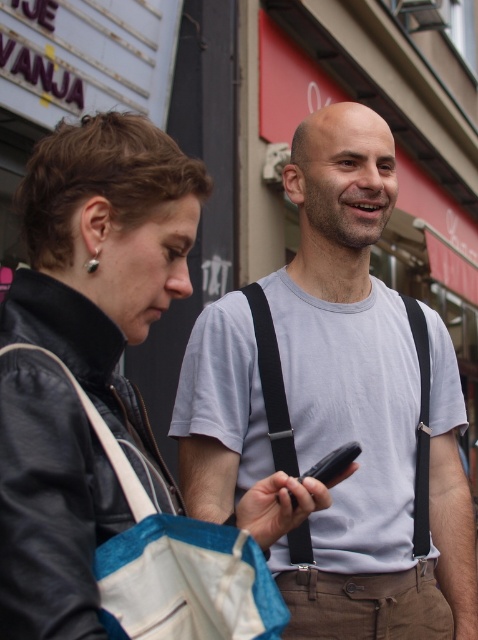
Question: Considering the real-world distances, which object is farthest from the black matte smartphone at center?

Choices:
 (A) blue fabric shopping bag at center
 (B) gray cotton shirt at center

Answer: (B)

Question: Which point appears closest to the camera in this image?

Choices:
 (A) (348, 458)
 (B) (349, 154)

Answer: (A)

Question: Is blue fabric shopping bag at center closer to camera compared to black matte smartphone at center?

Choices:
 (A) yes
 (B) no

Answer: (A)

Question: Does gray cotton shirt at center have a greater width compared to black matte smartphone at center?

Choices:
 (A) yes
 (B) no

Answer: (A)

Question: Is blue fabric shopping bag at center behind black matte smartphone at center?

Choices:
 (A) no
 (B) yes

Answer: (A)

Question: Which object appears closest to the camera in this image?

Choices:
 (A) gray cotton shirt at center
 (B) black matte smartphone at center
 (C) blue fabric shopping bag at center

Answer: (C)